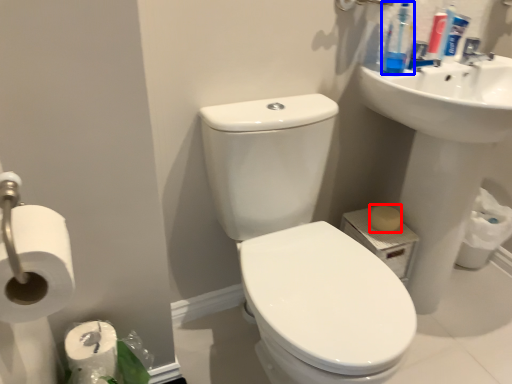
Question: Which object is closer to the camera taking this photo, soap (highlighted by a red box) or cleaning product (highlighted by a blue box)?

Choices:
 (A) soap
 (B) cleaning product

Answer: (B)